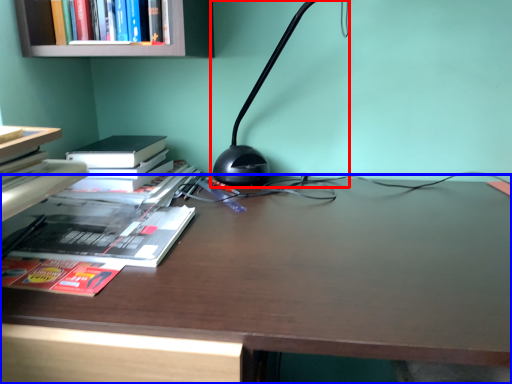
Question: Which point is closer to the camera, lamp (highlighted by a red box) or desk (highlighted by a blue box)?

Choices:
 (A) lamp
 (B) desk

Answer: (B)